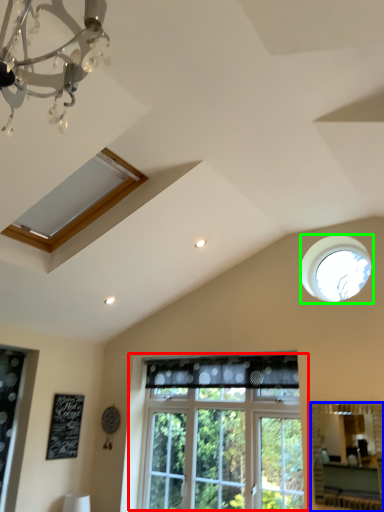
Question: Which object is the closest to the window (highlighted by a red box)? Choose among these: mirror (highlighted by a blue box) or window (highlighted by a green box).

Choices:
 (A) mirror
 (B) window

Answer: (A)